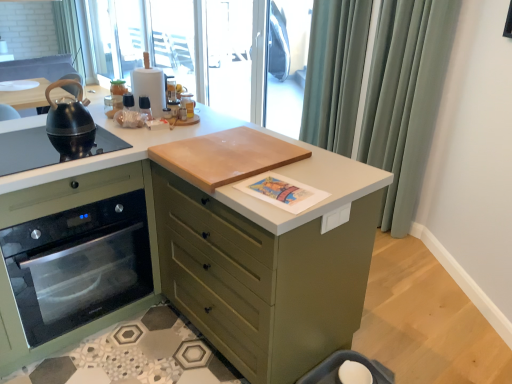
Question: Is satin fabric curtain at upper right shorter than satin green oven at left?

Choices:
 (A) no
 (B) yes

Answer: (A)

Question: Does satin fabric curtain at upper right touch satin green oven at left?

Choices:
 (A) no
 (B) yes

Answer: (A)

Question: Does satin fabric curtain at upper right have a greater width compared to satin green oven at left?

Choices:
 (A) no
 (B) yes

Answer: (A)

Question: Is satin fabric curtain at upper right oriented towards satin green oven at left?

Choices:
 (A) no
 (B) yes

Answer: (B)

Question: Is satin fabric curtain at upper right closer to camera compared to satin green oven at left?

Choices:
 (A) yes
 (B) no

Answer: (B)

Question: Considering the positions of transparent plastic window screen at upper center, the 1th window screen viewed from the back, and transparent plastic screen door at upper center, which ranks as the 2th screen door in left-to-right order, in the image, is transparent plastic window screen at upper center, the 1th window screen viewed from the back, taller or shorter than transparent plastic screen door at upper center, which ranks as the 2th screen door in left-to-right order,?

Choices:
 (A) tall
 (B) short

Answer: (A)

Question: Is transparent plastic window screen at upper center, the 2th window screen in the front-to-back sequence, in front of or behind transparent plastic screen door at upper center, positioned as the 1th screen door in right-to-left order, in the image?

Choices:
 (A) behind
 (B) front

Answer: (A)

Question: In terms of size, does transparent plastic window screen at upper center, the 2th window screen in the front-to-back sequence, appear bigger or smaller than transparent plastic screen door at upper center, positioned as the 1th screen door in right-to-left order?

Choices:
 (A) small
 (B) big

Answer: (B)

Question: Looking at their shapes, would you say transparent plastic window screen at upper center, the 2th window screen in the front-to-back sequence, is wider or thinner than transparent plastic screen door at upper center, which ranks as the 2th screen door in left-to-right order?

Choices:
 (A) wide
 (B) thin

Answer: (B)

Question: From a real-world perspective, is satin fabric curtain at upper right physically located above or below transparent plastic screen door at upper center, which ranks as the 2th screen door in left-to-right order?

Choices:
 (A) above
 (B) below

Answer: (B)

Question: Considering the positions of point (318, 19) and point (290, 54), is point (318, 19) closer or farther from the camera than point (290, 54)?

Choices:
 (A) farther
 (B) closer

Answer: (B)

Question: Choose the correct answer: Is satin fabric curtain at upper right inside transparent plastic screen door at upper center, which ranks as the 2th screen door in left-to-right order, or outside it?

Choices:
 (A) outside
 (B) inside

Answer: (A)

Question: Is satin fabric curtain at upper right taller or shorter than transparent plastic screen door at upper center, positioned as the 1th screen door in right-to-left order?

Choices:
 (A) short
 (B) tall

Answer: (B)

Question: From their relative heights in the image, would you say transparent plastic window screen at upper center, which appears as the second window screen when viewed from the right, is taller or shorter than satin green oven at left?

Choices:
 (A) tall
 (B) short

Answer: (A)

Question: Based on their positions, is transparent plastic window screen at upper center, the 1th window screen viewed from the back, located to the left or right of satin green oven at left?

Choices:
 (A) left
 (B) right

Answer: (A)